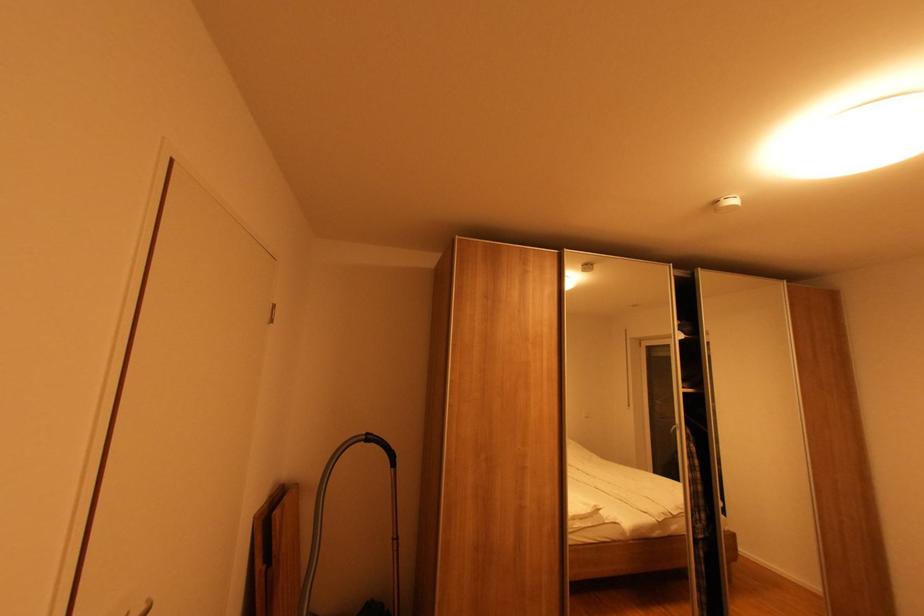
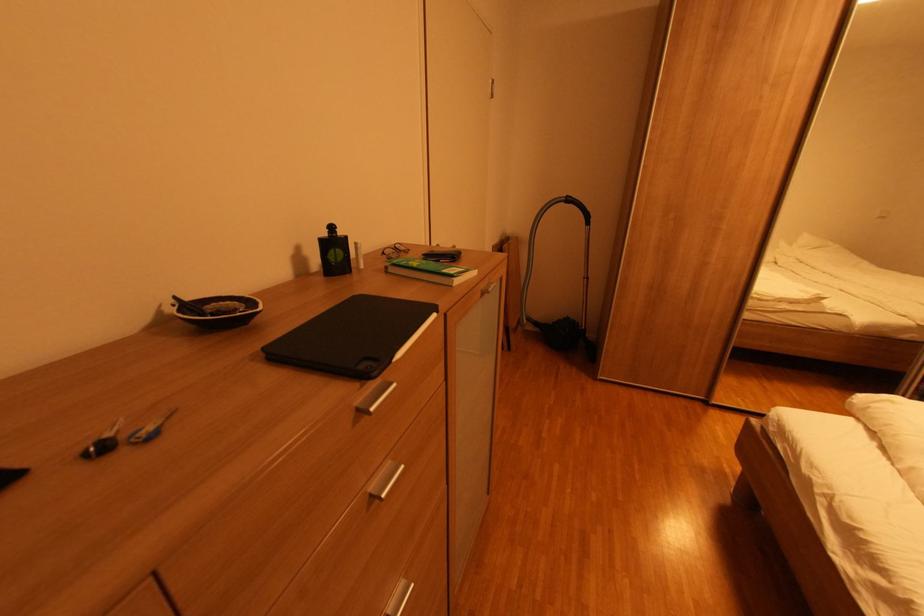
Find the pixel in the second image that matches point (369, 444) in the first image.

(568, 205)